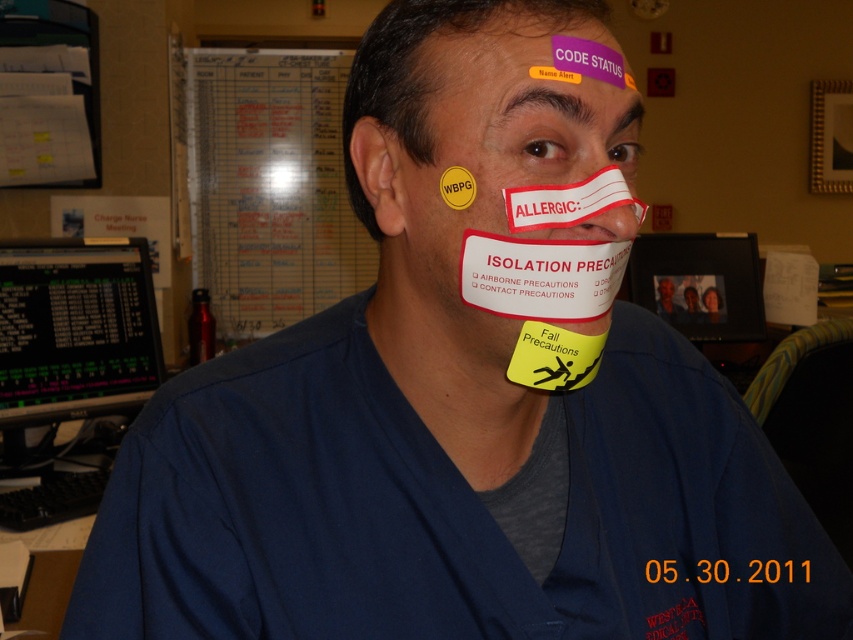
Question: Which of these objects is positioned closest to the purple sticker at upper center?

Choices:
 (A) green lcd monitor at left
 (B) matte white nose at center
 (C) yellow matte sticker at upper center

Answer: (C)

Question: Which object is the closest to the purple sticker at upper center?

Choices:
 (A) matte white nose at center
 (B) yellow matte sticker at upper center
 (C) green lcd monitor at left

Answer: (B)

Question: Does green lcd monitor at left appear on the left side of matte white nose at center?

Choices:
 (A) yes
 (B) no

Answer: (A)

Question: Does yellow matte sticker at upper center have a lesser width compared to purple sticker at upper center?

Choices:
 (A) yes
 (B) no

Answer: (B)

Question: Observing the image, what is the correct spatial positioning of yellow matte sticker at upper center in reference to purple sticker at upper center?

Choices:
 (A) below
 (B) above

Answer: (A)

Question: Which point is closer to the camera?

Choices:
 (A) (494, 28)
 (B) (535, 61)
 (C) (625, 237)

Answer: (B)